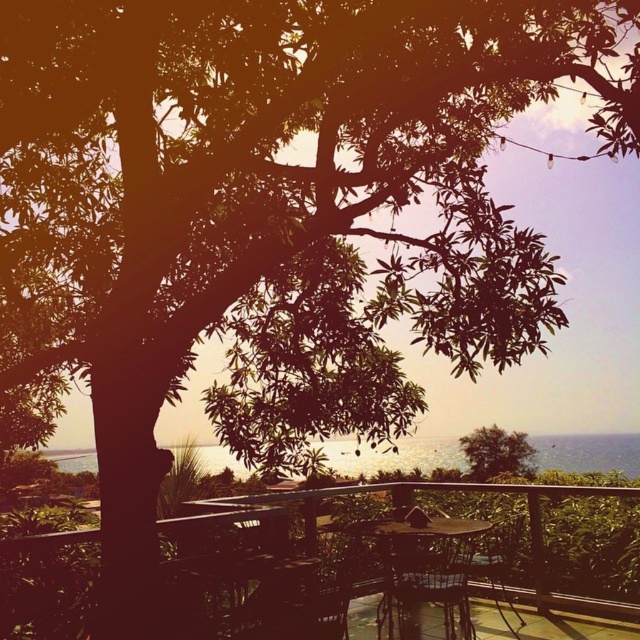
Is metallic brown table at center behind green leafy tree at center?

No, metallic brown table at center is in front of green leafy tree at center.

Does point (401, 636) come behind point (493, 474)?

No, (401, 636) is closer to viewer.

This screenshot has height=640, width=640. Find the location of `metallic brown table at center`. metallic brown table at center is located at coordinates (422, 566).

Can you confirm if wooden table at center is positioned above metallic brown table at center?

Indeed, wooden table at center is positioned over metallic brown table at center.

What do you see at coordinates (424, 490) in the screenshot? I see `wooden table at center` at bounding box center [424, 490].

Locate an element on the screen. wooden table at center is located at coordinates (424, 490).

This screenshot has height=640, width=640. In order to click on wooden table at center in this screenshot , I will do `click(424, 490)`.

Between metallic brown table at center and wooden chair at center, which one has less height?

With less height is wooden chair at center.

How distant is metallic brown table at center from wooden chair at center?

metallic brown table at center is 51.78 centimeters from wooden chair at center.

Who is more forward, (461, 598) or (481, 566)?

Positioned in front is point (461, 598).

The height and width of the screenshot is (640, 640). In order to click on metallic brown table at center in this screenshot , I will do `click(422, 566)`.